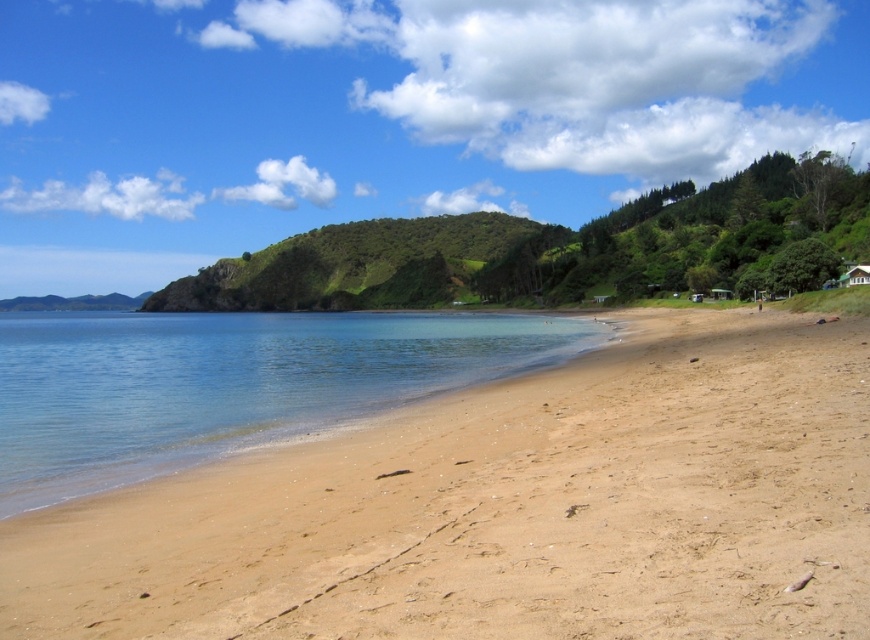
Is sandy beach at lower right smaller than clear blue water at center?

Indeed, sandy beach at lower right has a smaller size compared to clear blue water at center.

Between sandy beach at lower right and clear blue water at center, which one has less height?

sandy beach at lower right is shorter.

Is point (857, 406) positioned after point (365, 323)?

No, (857, 406) is closer to viewer.

The image size is (870, 640). Find the location of `sandy beach at lower right`. sandy beach at lower right is located at coordinates (506, 508).